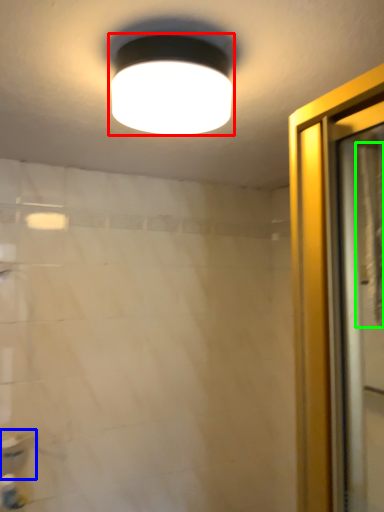
Question: Which is nearer to the lamp (highlighted by a red box)? sink (highlighted by a blue box) or shower curtain (highlighted by a green box).

Choices:
 (A) sink
 (B) shower curtain

Answer: (B)